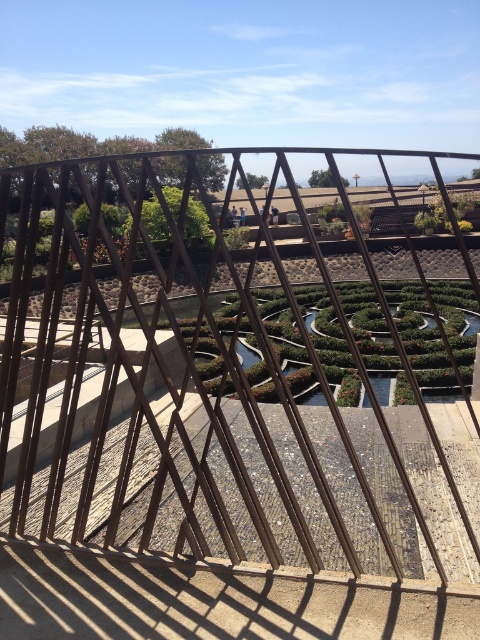
Question: Which point is farther from the camera taking this photo?

Choices:
 (A) (330, 172)
 (B) (12, 493)

Answer: (A)

Question: Which object is farther from the camera taking this photo?

Choices:
 (A) metallic wire fence at center
 (B) green leafy hedge at center

Answer: (B)

Question: Can you confirm if metallic wire fence at center is positioned to the right of green leafy hedge at center?

Choices:
 (A) yes
 (B) no

Answer: (B)

Question: Is metallic wire fence at center to the right of green leafy hedge at center from the viewer's perspective?

Choices:
 (A) no
 (B) yes

Answer: (A)

Question: Does metallic wire fence at center appear over green leafy hedge at center?

Choices:
 (A) no
 (B) yes

Answer: (A)